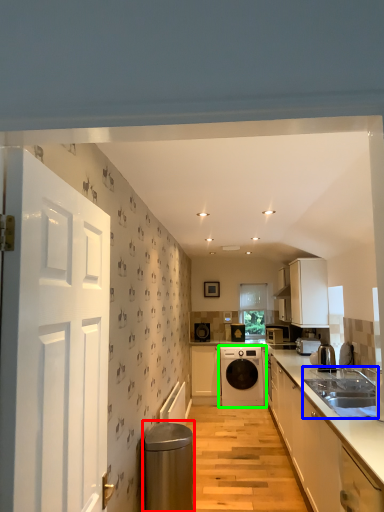
Question: Which object is positioned farthest from water heater (highlighted by a red box)? Select from sink (highlighted by a blue box) and home appliance (highlighted by a green box).

Choices:
 (A) sink
 (B) home appliance

Answer: (B)